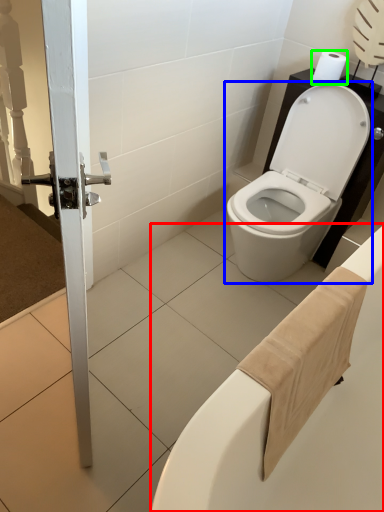
Question: Considering the real-world distances, which object is closest to bath (highlighted by a red box)? toilet (highlighted by a blue box) or toilet paper (highlighted by a green box).

Choices:
 (A) toilet
 (B) toilet paper

Answer: (A)